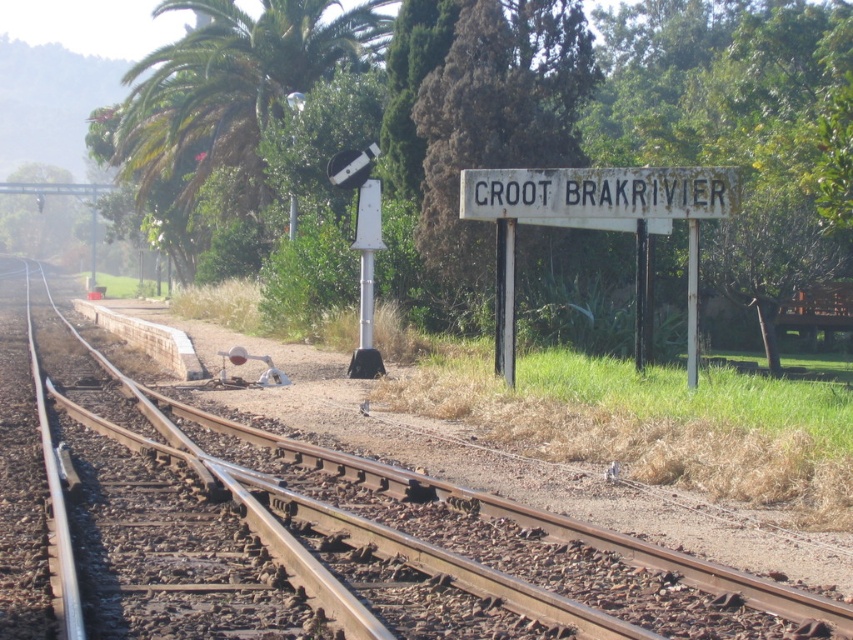
Question: Can you confirm if brown gravel train track at center is wider than green leafy tree at upper right?

Choices:
 (A) no
 (B) yes

Answer: (B)

Question: Which point appears farthest from the camera in this image?

Choices:
 (A) (444, 228)
 (B) (764, 308)
 (C) (689, 316)

Answer: (B)

Question: Which object is positioned closest to the white faded sign at center?

Choices:
 (A) brown gravel train track at center
 (B) green leafy tree at upper right

Answer: (A)

Question: Is green leafy tree at upper right to the left of white faded sign at center from the viewer's perspective?

Choices:
 (A) yes
 (B) no

Answer: (B)

Question: Is white rusty sign at center smaller than white faded sign at center?

Choices:
 (A) no
 (B) yes

Answer: (A)

Question: Which point is closer to the camera?

Choices:
 (A) (447, 563)
 (B) (642, 182)

Answer: (A)